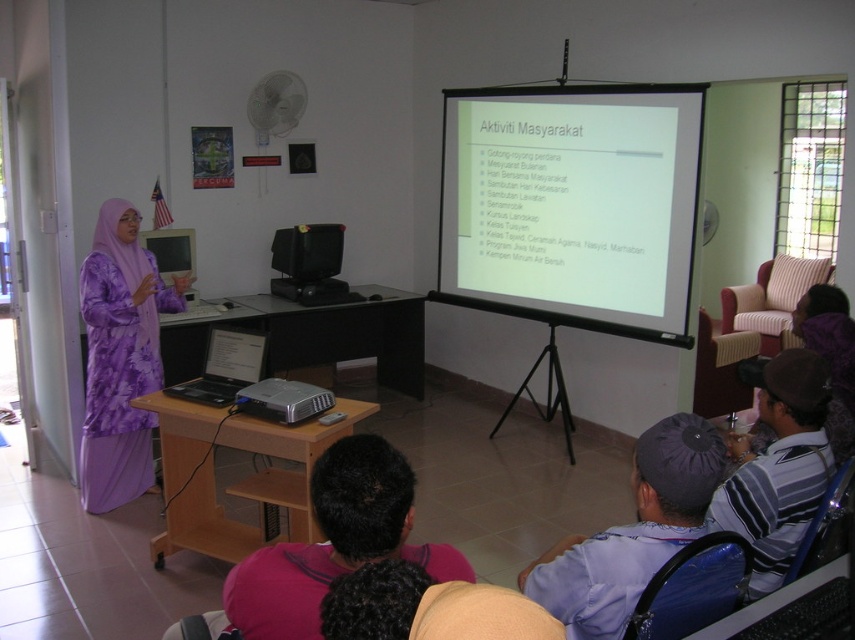
Question: Is white matte projection screen at upper center above matte black laptop at center?

Choices:
 (A) no
 (B) yes

Answer: (B)

Question: Considering the real-world distances, which object is closest to the matte black laptop at center?

Choices:
 (A) dark blue fabric cap at lower center
 (B) blue fabric robe at lower right
 (C) black matte table at center

Answer: (C)

Question: Which object is the closest to the blue fabric robe at lower right?

Choices:
 (A) black matte table at center
 (B) silver metallic projector at center
 (C) striped fabric shirt at lower right
 (D) wooden table at center

Answer: (C)

Question: Is white matte projection screen at upper center thinner than black matte table at center?

Choices:
 (A) no
 (B) yes

Answer: (B)

Question: Does purple floral robe at left appear on the right side of black matte table at center?

Choices:
 (A) no
 (B) yes

Answer: (A)

Question: Which point appears closest to the camera in this image?

Choices:
 (A) (231, 339)
 (B) (526, 211)
 (C) (228, 561)

Answer: (C)